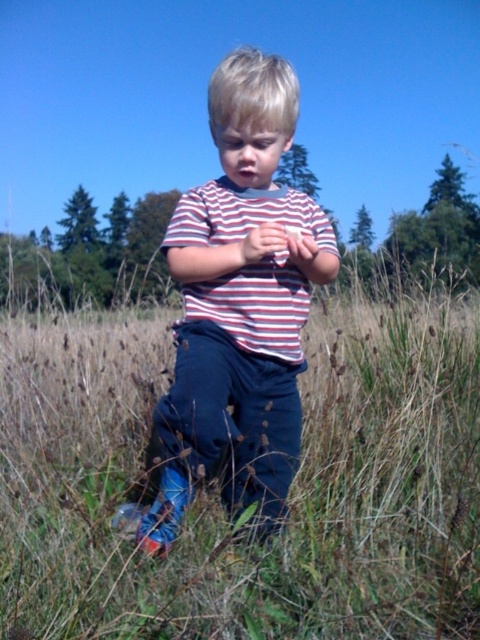
You are a photographer trying to capture the child in the image. The blue jeans at center and the striped fabric shirt at center are both important elements. Which item should you focus on first to ensure it appears sharp in the photo?

The blue jeans at center is closer to the viewer than the striped fabric shirt at center, so you should focus on the blue jeans at center first to ensure it appears sharp in the photo.

You are a fashion designer analyzing the outfit of the child in the image. The child is wearing blue jeans at center and striped fabric shirt at center. How far apart are these two clothing items on the child?

The blue jeans at center and striped fabric shirt at center are 4.59 feet apart.

The image shows a child in a grassy field. The child is wearing horizontally striped red and white shirt and dark blue pants. There is a point marked at coordinates (217, 493). What object is located at that point?

The point at (217, 493) indicates blue jeans at center.